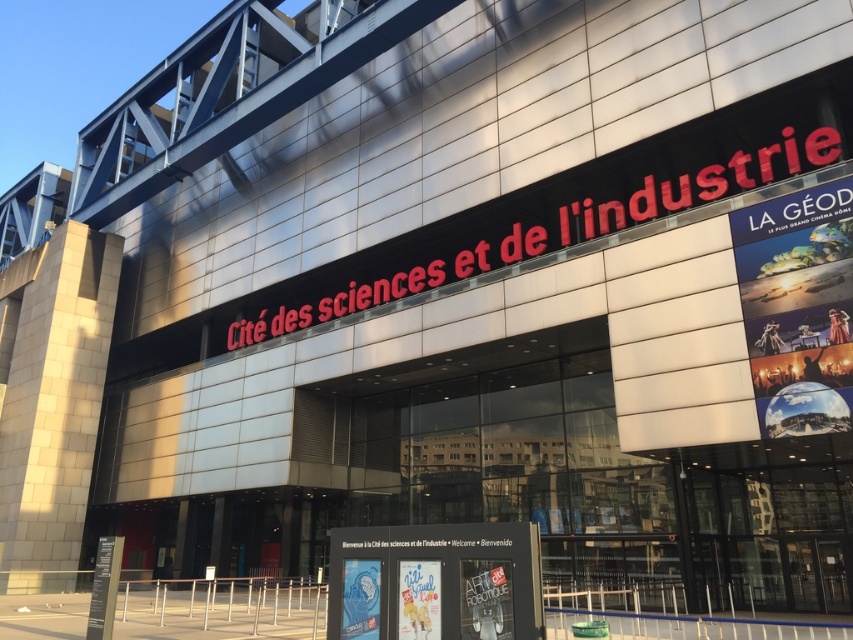
You are standing in front of the Cite des sciences et de l industrie building and want to read both the metallic poster at right and the white plastic sign at center. Which one do you need to look up at first?

The metallic poster at right is above the white plastic sign at center, so you need to look up at the metallic poster at right first before looking down to read the white plastic sign at center.

You are standing in front of the building and want to find the metallic poster at right. According to the coordinates given, where should you look relative to the main entrance?

The metallic poster at right is located at coordinates point [798,307], which means it is positioned to the right and slightly below the center of the building, so you should look to the right side and lower part of the building from the entrance.